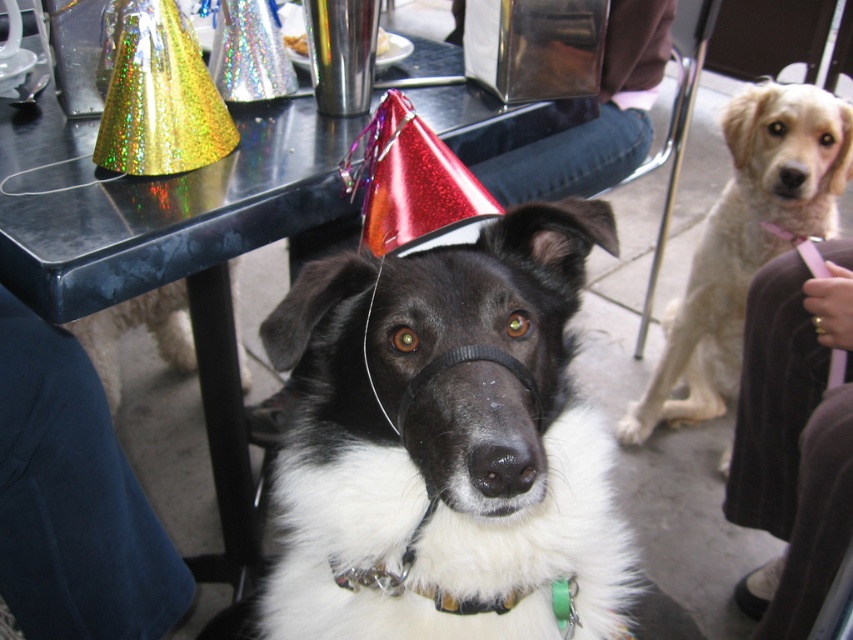
Question: Can you confirm if brown wool pants at lower right is positioned below light beige fur at right?

Choices:
 (A) no
 (B) yes

Answer: (B)

Question: Among these points, which one is farthest from the camera?

Choices:
 (A) (556, 429)
 (B) (618, 44)
 (C) (213, 314)
 (D) (743, 419)

Answer: (B)

Question: Does metallic reflective table at center have a greater width compared to dark blue fabric at lower left?

Choices:
 (A) no
 (B) yes

Answer: (B)

Question: Among these objects, which one is farthest from the camera?

Choices:
 (A) metallic napkin holder at center
 (B) brown wool pants at lower right
 (C) dark blue fabric at lower left

Answer: (A)

Question: Which of the following is the farthest from the observer?

Choices:
 (A) (28, 465)
 (B) (804, 150)

Answer: (B)

Question: Is dark blue fabric at lower left thinner than metallic napkin holder at center?

Choices:
 (A) yes
 (B) no

Answer: (A)